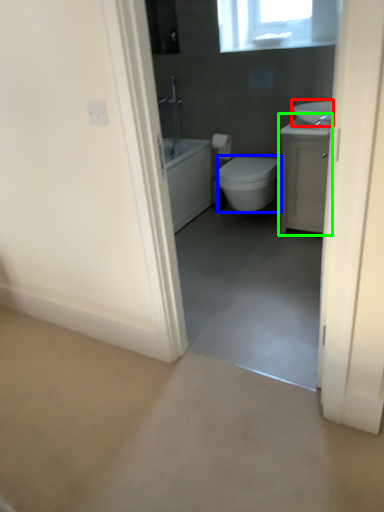
Question: Estimate the real-world distances between objects in this image. Which object is closer to sink (highlighted by a red box), bidet (highlighted by a blue box) or bathroom cabinet (highlighted by a green box)?

Choices:
 (A) bidet
 (B) bathroom cabinet

Answer: (B)